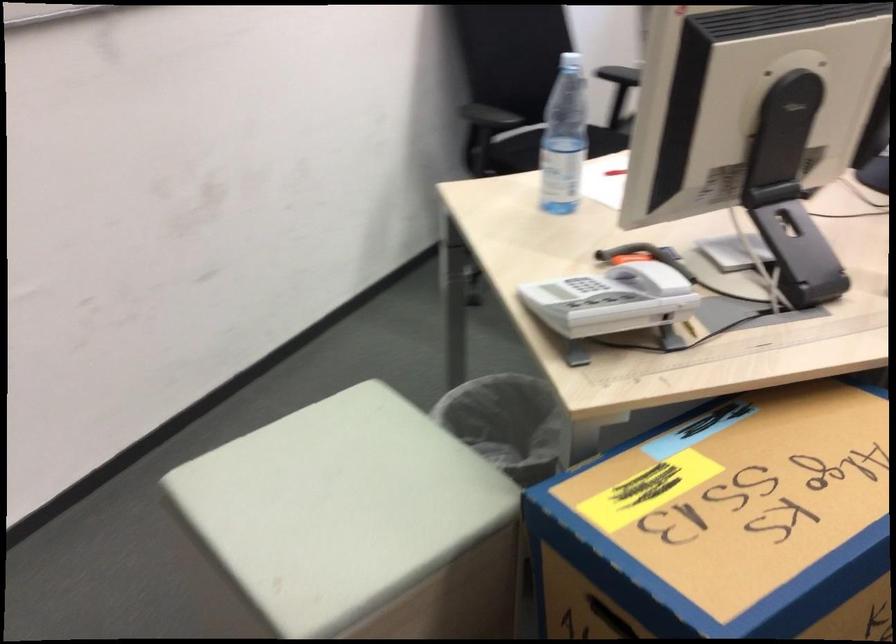
You are a GUI agent. You are given a task and a screenshot of the screen. Output one action in this format:
    pyautogui.click(x=<x>, y=<y>)
    Task: Click on the white telephone handset
    This screenshot has width=896, height=644.
    Given the screenshot: What is the action you would take?
    pyautogui.click(x=648, y=268)